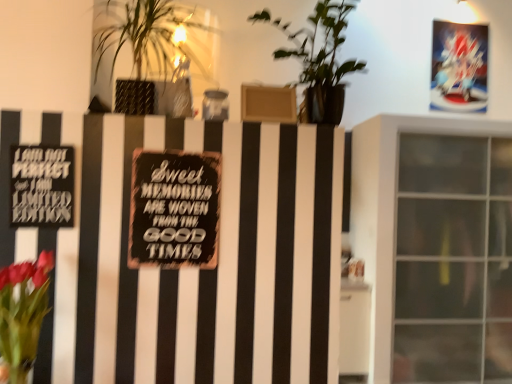
Question: Is black matte sign at left, marked as the 1th plaque in a left-to-right arrangement, next to green leafy plant at upper left, which appears as the second houseplant when viewed from the right, and touching it?

Choices:
 (A) yes
 (B) no

Answer: (B)

Question: Is black matte sign at left, marked as the 1th plaque in a left-to-right arrangement, to the right of green leafy plant at upper left, which appears as the second houseplant when viewed from the right, from the viewer's perspective?

Choices:
 (A) yes
 (B) no

Answer: (B)

Question: Is the position of black matte sign at left, the second plaque in the back-to-front sequence, less distant than that of green leafy plant at upper left, which appears as the second houseplant when viewed from the right?

Choices:
 (A) no
 (B) yes

Answer: (A)

Question: From the image's perspective, does black matte sign at left, the second plaque in the back-to-front sequence, appear higher than green leafy plant at upper left, acting as the first houseplant starting from the left?

Choices:
 (A) yes
 (B) no

Answer: (B)

Question: Considering the relative sizes of black matte sign at left, arranged as the first plaque when viewed from the front, and green leafy plant at upper left, acting as the first houseplant starting from the left, in the image provided, is black matte sign at left, arranged as the first plaque when viewed from the front, shorter than green leafy plant at upper left, acting as the first houseplant starting from the left,?

Choices:
 (A) yes
 (B) no

Answer: (A)

Question: From the image's perspective, is green leafy plant at center, which is counted as the first houseplant, starting from the right, positioned above or below black matte sign at left, the second plaque in the back-to-front sequence?

Choices:
 (A) above
 (B) below

Answer: (A)

Question: Is point (315, 91) positioned closer to the camera than point (40, 193)?

Choices:
 (A) closer
 (B) farther

Answer: (B)

Question: From a real-world perspective, relative to black matte sign at left, the second plaque in the back-to-front sequence, is green leafy plant at center, which is counted as the second houseplant, starting from the left, vertically above or below?

Choices:
 (A) below
 (B) above

Answer: (B)

Question: Considering their positions, is green leafy plant at center, which is counted as the first houseplant, starting from the right, located in front of or behind black matte sign at left, the second plaque in the back-to-front sequence?

Choices:
 (A) behind
 (B) front

Answer: (B)

Question: Considering the positions of point (32, 360) and point (16, 193), is point (32, 360) closer or farther from the camera than point (16, 193)?

Choices:
 (A) farther
 (B) closer

Answer: (B)

Question: Visually, is vivid pink petals at lower left positioned to the left or to the right of black matte sign at left, marked as the 1th plaque in a left-to-right arrangement?

Choices:
 (A) left
 (B) right

Answer: (B)

Question: Considering the positions of vivid pink petals at lower left and black matte sign at left, marked as the 2th plaque in a right-to-left arrangement, in the image, is vivid pink petals at lower left wider or thinner than black matte sign at left, marked as the 2th plaque in a right-to-left arrangement,?

Choices:
 (A) wide
 (B) thin

Answer: (A)

Question: From their relative heights in the image, would you say vivid pink petals at lower left is taller or shorter than black matte sign at left, marked as the 1th plaque in a left-to-right arrangement?

Choices:
 (A) tall
 (B) short

Answer: (A)

Question: Does point (202, 213) appear closer or farther from the camera than point (17, 148)?

Choices:
 (A) closer
 (B) farther

Answer: (B)

Question: In terms of size, does black matte sign at center, which appears as the 1th plaque when viewed from the back, appear bigger or smaller than black matte sign at left, marked as the 1th plaque in a left-to-right arrangement?

Choices:
 (A) small
 (B) big

Answer: (B)